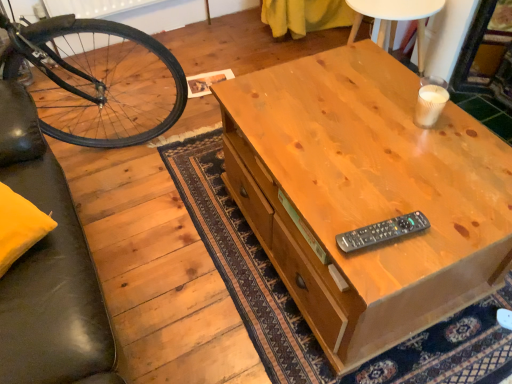
Find the location of a particular element. This screenshot has width=512, height=384. vacant space situated on the left part of black plastic remote at center is located at coordinates (329, 220).